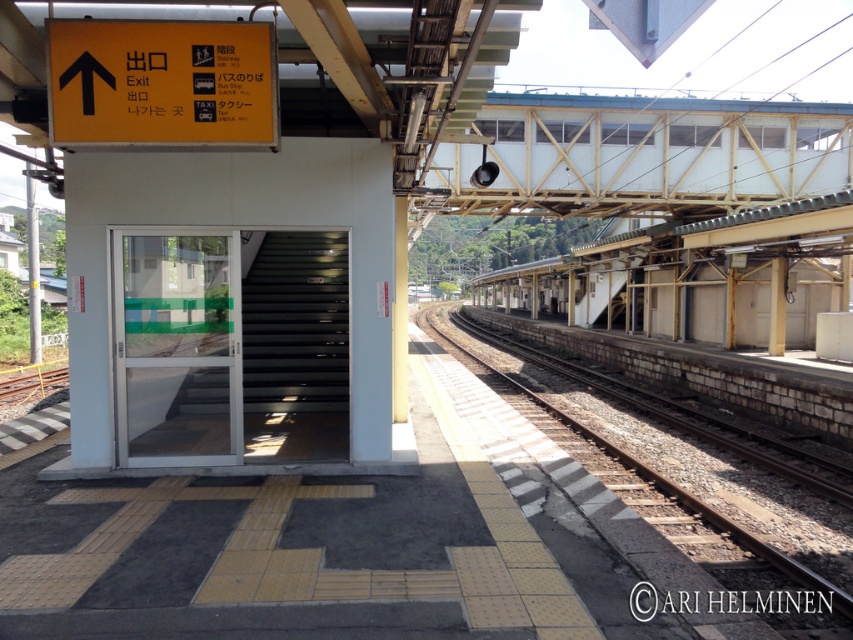
Question: Is yellow plastic sign at upper left positioned behind brown gravel track at center?

Choices:
 (A) no
 (B) yes

Answer: (B)

Question: Where is white painted steel bridge at upper right located in relation to yellow plastic sign at upper left in the image?

Choices:
 (A) above
 (B) below

Answer: (A)

Question: Which is nearer to the brown gravel track at center?

Choices:
 (A) yellow plastic sign at upper left
 (B) white painted steel bridge at upper right

Answer: (A)

Question: Is white painted steel bridge at upper right smaller than yellow plastic sign at upper left?

Choices:
 (A) yes
 (B) no

Answer: (B)

Question: Estimate the real-world distances between objects in this image. Which object is closer to the white painted steel bridge at upper right?

Choices:
 (A) brown gravel track at center
 (B) yellow plastic sign at upper left

Answer: (A)

Question: Which of these objects is positioned farthest from the white painted steel bridge at upper right?

Choices:
 (A) brown gravel track at center
 (B) yellow plastic sign at upper left

Answer: (B)